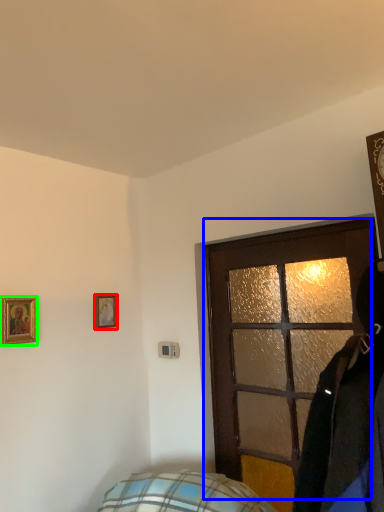
Question: Which object is the closest to the picture frame (highlighted by a red box)? Choose among these: door (highlighted by a blue box) or picture frame (highlighted by a green box).

Choices:
 (A) door
 (B) picture frame

Answer: (B)